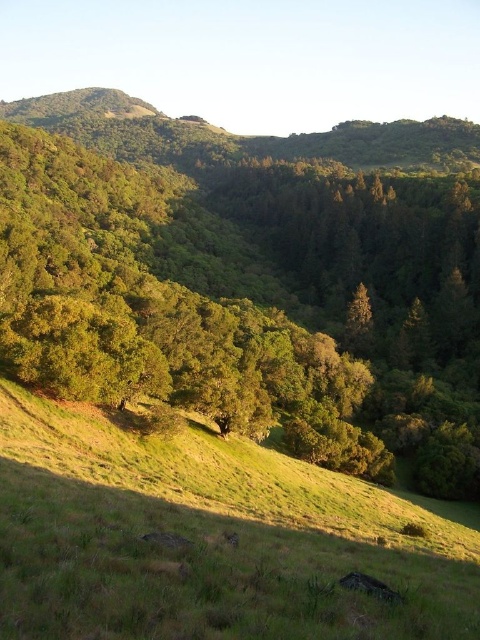
You are standing on the green grassy hillside at lower center and want to reach the green leafy tree at center. Which direction should you move to get closer to the tree?

The green leafy tree at center is positioned over the green grassy hillside at lower center, so you should move upward to get closer to the tree.

You are planning to plant a new tree in the green grassy hillside at lower center. Considering the existing green leafy tree at center, which is much taller, how might the height of the new tree compare to the existing one after five years?

The green leafy tree at center is much taller than the green grassy hillside at lower center. After five years, the new tree planted in the green grassy hillside at lower center would likely be shorter than the existing green leafy tree at center, as the existing tree already has a significant height advantage.

You are standing at the origin point of the coordinate system in this landscape. Where exactly is the green leafy tree at center located?

The green leafy tree at center is located at the coordinate point of (x=253, y=292).